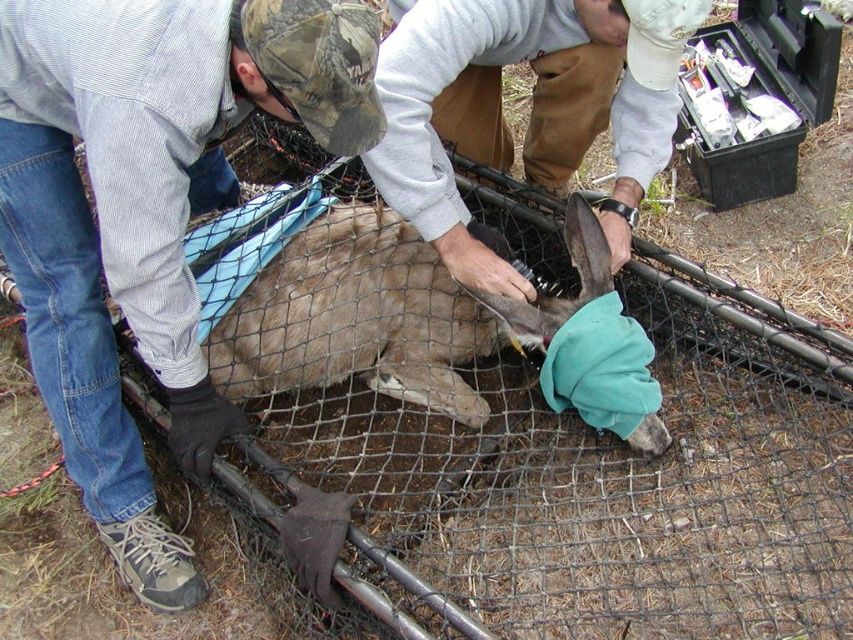
You are a wildlife photographer observing the scene. You need to position your camera to capture both the camouflage hat at upper left and the brown leather glove at center in the same frame. Based on their positions, which object should you frame first to ensure both are visible?

The camouflage hat at upper left is positioned on the left side of brown leather glove at center. To capture both in the same frame, you should frame the camouflage hat at upper left first since it is on the left, allowing the brown leather glove at center to be included to its right.

You are a wildlife researcher observing the scene and need to determine the proximity of objects. Which object is nearer to you between the camouflage hat at upper left and the brown fur at center?

The camouflage hat at upper left is closer to the viewer than the brown fur at center.